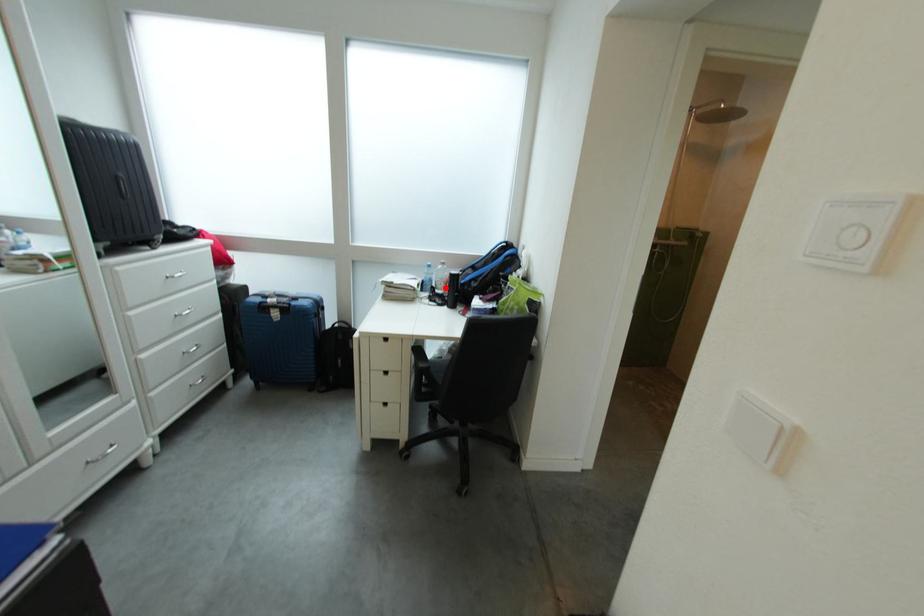
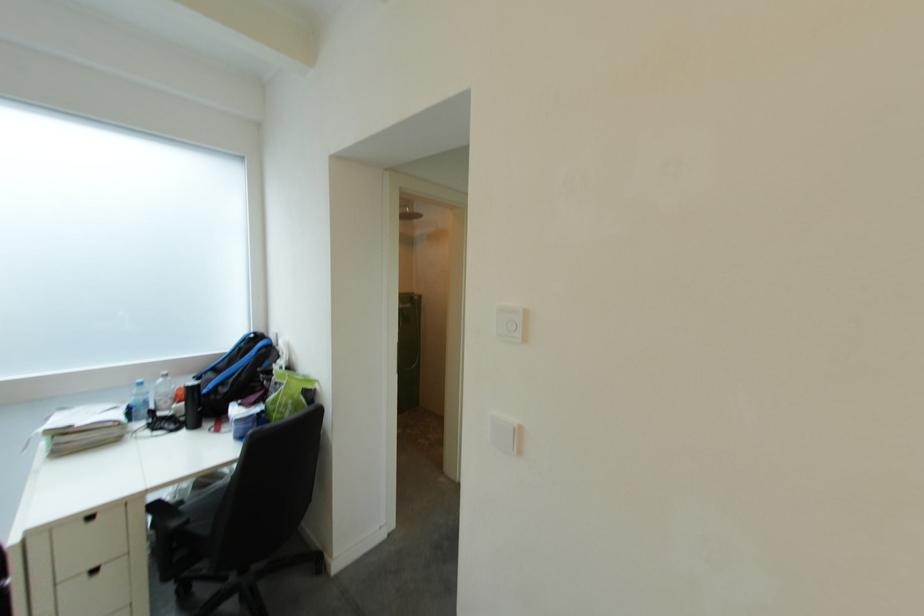
Locate, in the second image, the point that corresponds to the highlighted location in the first image.

(163, 410)